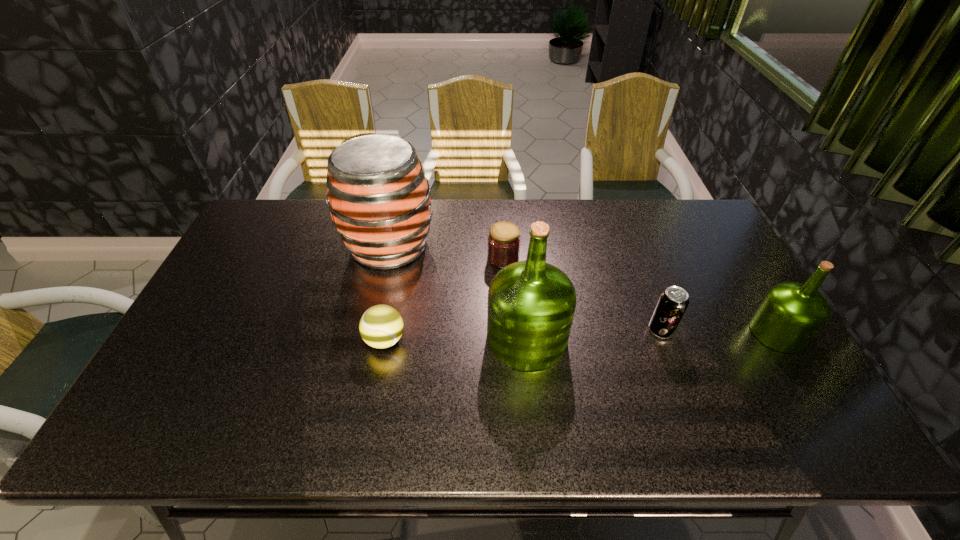
The width and height of the screenshot is (960, 540). I want to click on the taller olive oil, so click(x=531, y=304).

This screenshot has height=540, width=960. I want to click on the shorter olive oil, so click(x=791, y=314).

Image resolution: width=960 pixels, height=540 pixels. Identify the location of the right olive oil. (791, 314).

Locate an element on the screen. The height and width of the screenshot is (540, 960). cider is located at coordinates tap(379, 198).

I want to click on jam, so click(503, 241).

Find the location of a particular element. The image size is (960, 540). the fifth object from left to right is located at coordinates (673, 302).

You are a GUI agent. You are given a task and a screenshot of the screen. Output one action in this format:
    pyautogui.click(x=<x>, y=<y>)
    Task: Click on the fourth tallest object
    The height and width of the screenshot is (540, 960).
    Given the screenshot: What is the action you would take?
    pyautogui.click(x=673, y=302)

This screenshot has height=540, width=960. Identify the location of tennis ball. (381, 326).

At what (x,y) coordinates should I click in order to perform the action: click on vacant space located 0.110m on the right of the taller olive oil. Please return your answer as a coordinate pair (x, y). Looking at the image, I should click on [609, 338].

Locate an element on the screen. Image resolution: width=960 pixels, height=540 pixels. vacant space located on the left of the fourth shortest object is located at coordinates (684, 332).